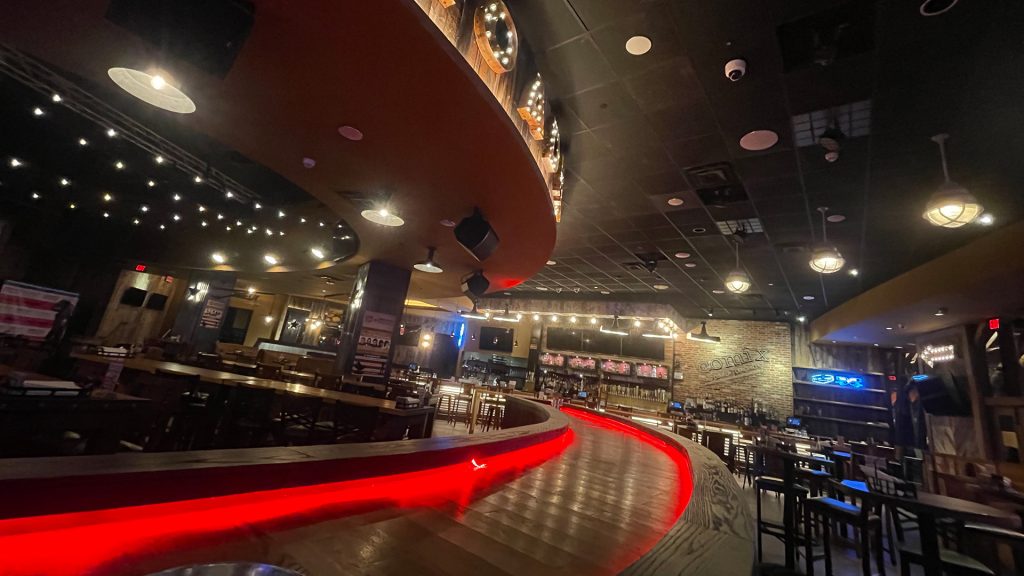
Identify the location of wall. (742, 381).